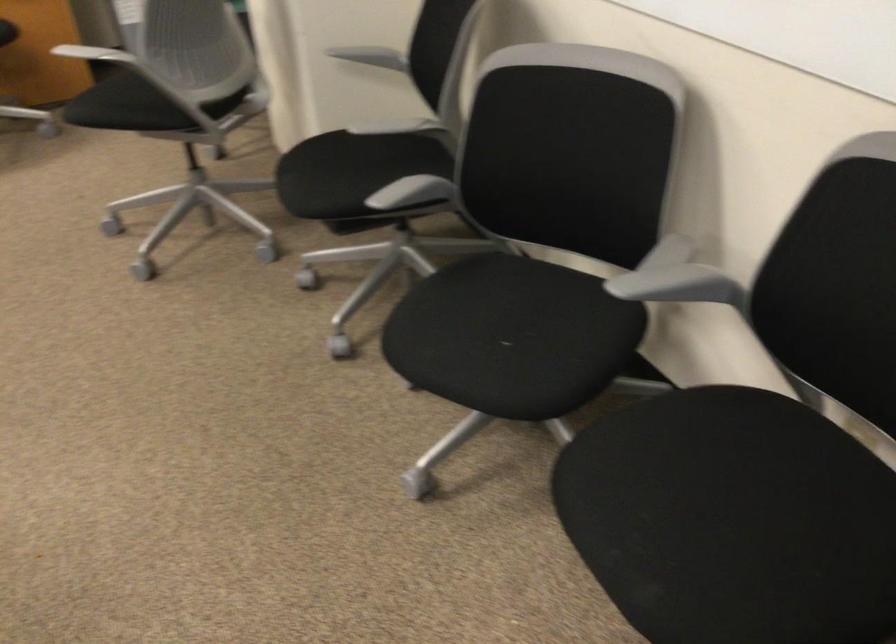
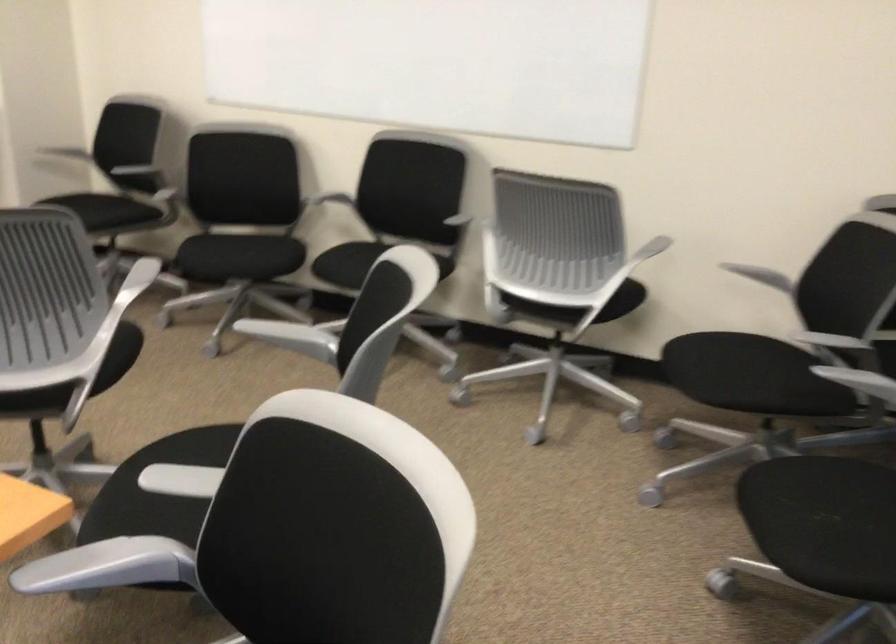
Find the pixel in the second image that matches [329,192] in the first image.

(97, 213)